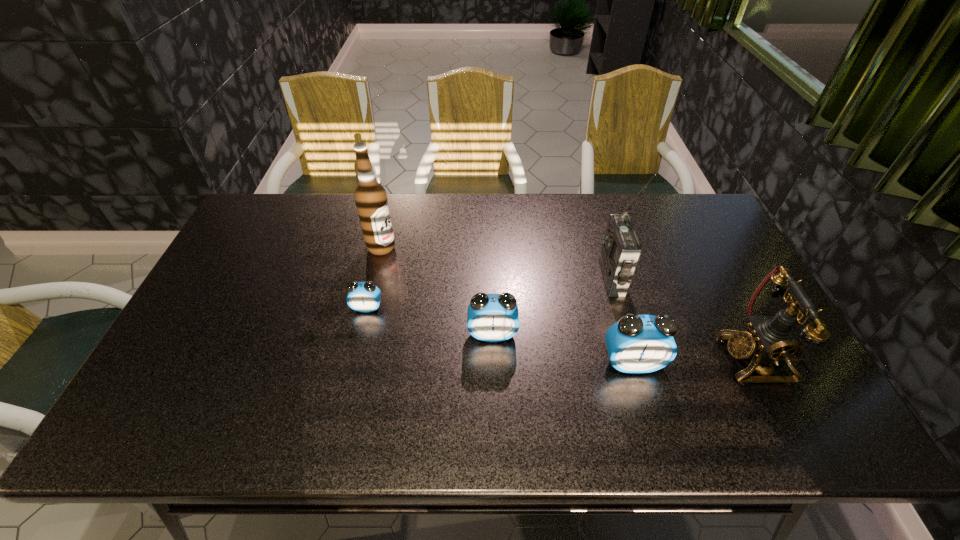
Find the location of a particular element. This screenshot has width=960, height=540. object at the right edge is located at coordinates (769, 338).

Locate an element on the screen. The width and height of the screenshot is (960, 540). object present at the near right corner is located at coordinates (769, 338).

Locate an element on the screen. free space at the far edge of the desktop is located at coordinates (638, 210).

This screenshot has height=540, width=960. In the image, there is a desktop. What are the coordinates of `vacant region at the near edge` in the screenshot? It's located at (692, 391).

Where is `free location at the left edge of the desktop`? This screenshot has height=540, width=960. free location at the left edge of the desktop is located at coordinates (239, 288).

Identify the location of free space at the right edge of the desktop. This screenshot has width=960, height=540. (732, 302).

Locate an element on the screen. The height and width of the screenshot is (540, 960). vacant space at the far left corner of the desktop is located at coordinates (253, 222).

Locate an element on the screen. vacant area between the alcohol and the telephone is located at coordinates (567, 303).

Locate an element on the screen. This screenshot has width=960, height=540. unoccupied position between the farthest object and the second tallest alarm clock is located at coordinates (437, 291).

I want to click on vacant area between the radio receiver and the second farthest alarm clock, so click(552, 306).